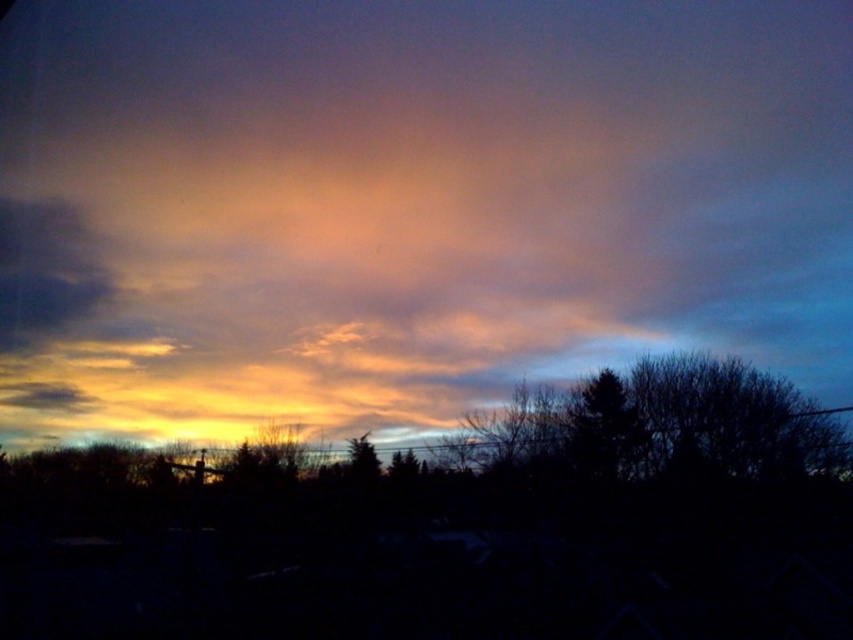
Is point (621, 268) in front of point (683, 412)?

No, it is behind (683, 412).

Does point (656, 88) lie behind point (735, 368)?

Yes, point (656, 88) is behind point (735, 368).

Where is `cloudy sky at upper center`? Image resolution: width=853 pixels, height=640 pixels. cloudy sky at upper center is located at coordinates (408, 204).